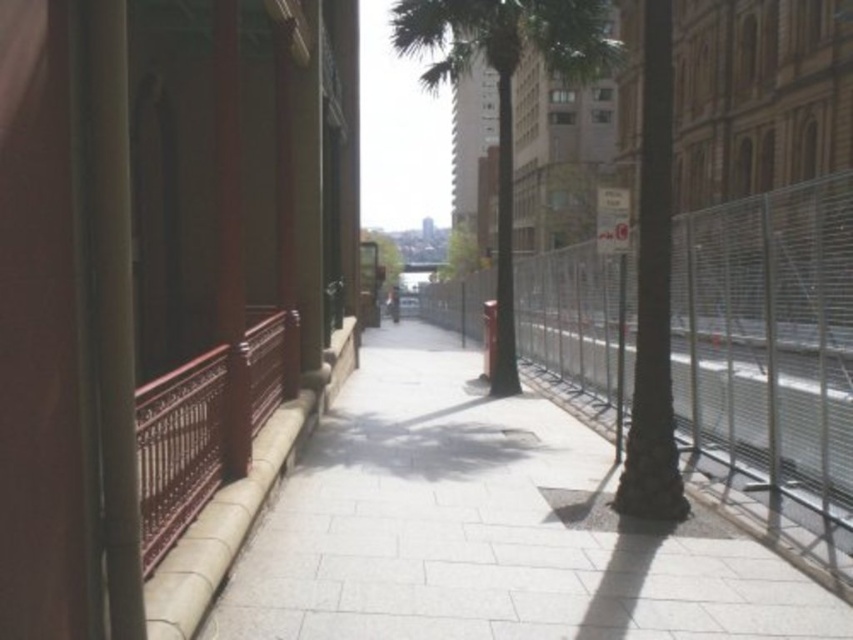
Question: Can you confirm if metallic chain-link fence at center-right is positioned above green leafy palm tree at center?

Choices:
 (A) yes
 (B) no

Answer: (B)

Question: Which of the following is the closest to the observer?

Choices:
 (A) white stone pavement at center
 (B) metallic chain-link fence at center-right

Answer: (A)

Question: Is white stone pavement at center positioned at the back of green leafy palm tree at center?

Choices:
 (A) yes
 (B) no

Answer: (B)

Question: Estimate the real-world distances between objects in this image. Which object is closer to the white stone pavement at center?

Choices:
 (A) green leafy palm tree at center
 (B) metallic chain-link fence at center-right

Answer: (A)

Question: Can you confirm if white stone pavement at center is smaller than metallic chain-link fence at center-right?

Choices:
 (A) yes
 (B) no

Answer: (A)

Question: Which of the following is the closest to the observer?

Choices:
 (A) (738, 340)
 (B) (563, 67)
 (C) (563, 616)

Answer: (C)